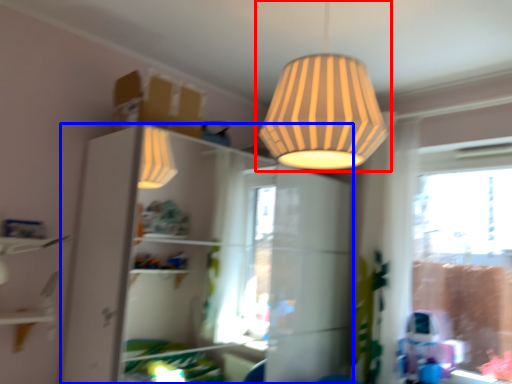
Question: Which point is further to the camera, lamp (highlighted by a red box) or dresser (highlighted by a blue box)?

Choices:
 (A) lamp
 (B) dresser

Answer: (B)